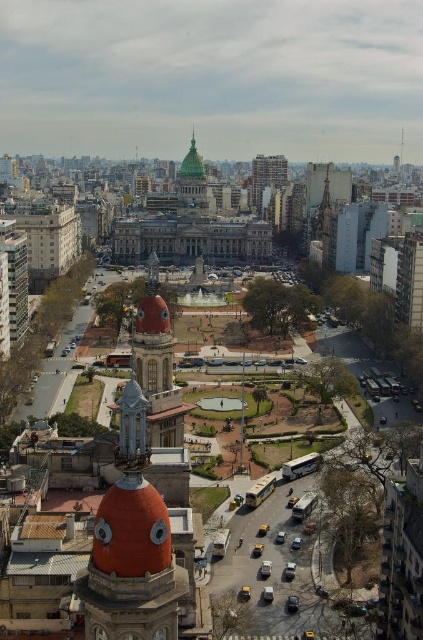
Describe the element at coordinates (131, 545) in the screenshot. I see `orange terracotta dome at center` at that location.

Is point (128, 419) positioned before point (257, 209)?

That is True.

Who is more forward, (x=131, y=472) or (x=260, y=188)?

Point (x=131, y=472) is more forward.

Where is `orange terracotta dome at center`? orange terracotta dome at center is located at coordinates (131, 545).

Between green glass dome at center and brick textured building at upper center, which one appears on the right side from the viewer's perspective?

brick textured building at upper center is more to the right.

This screenshot has width=423, height=640. Find the location of `green glass dome at center`. green glass dome at center is located at coordinates (192, 182).

Who is positioned more to the left, orange terracotta dome at center or green glass dome at center?

From the viewer's perspective, green glass dome at center appears more on the left side.

Is orange terracotta dome at center behind green glass dome at center?

No, it is in front of green glass dome at center.

Find the location of a particular element. The image size is (423, 640). orange terracotta dome at center is located at coordinates (131, 545).

I want to click on orange terracotta dome at center, so click(x=131, y=545).